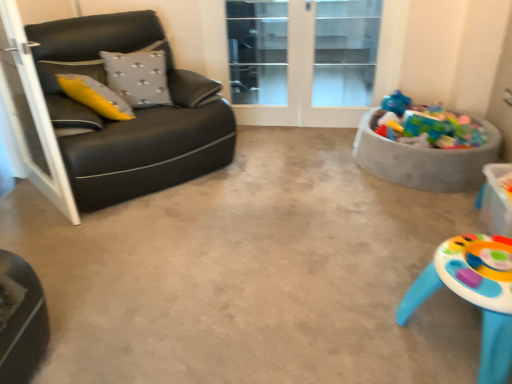
Question: Does transparent glass screen door at upper center, which ranks as the first screen door in right-to-left order, have a smaller size compared to plastic colorful toys at right?

Choices:
 (A) yes
 (B) no

Answer: (A)

Question: Is transparent glass screen door at upper center, placed as the 1th screen door when sorted from back to front, facing away from plastic colorful toys at right?

Choices:
 (A) no
 (B) yes

Answer: (A)

Question: Is transparent glass screen door at upper center, the second screen door when ordered from front to back, to the left of plastic colorful toys at right from the viewer's perspective?

Choices:
 (A) no
 (B) yes

Answer: (B)

Question: Is transparent glass screen door at upper center, which is the 2th screen door from left to right, wider than plastic colorful toys at right?

Choices:
 (A) yes
 (B) no

Answer: (B)

Question: From a real-world perspective, is transparent glass screen door at upper center, which ranks as the first screen door in right-to-left order, positioned over plastic colorful toys at right based on gravity?

Choices:
 (A) yes
 (B) no

Answer: (A)

Question: Is transparent glass door at center bigger or smaller than black leather couch at left?

Choices:
 (A) small
 (B) big

Answer: (A)

Question: Considering the positions of point (337, 54) and point (150, 127), is point (337, 54) closer or farther from the camera than point (150, 127)?

Choices:
 (A) closer
 (B) farther

Answer: (B)

Question: Looking at their shapes, would you say transparent glass door at center is wider or thinner than black leather couch at left?

Choices:
 (A) wide
 (B) thin

Answer: (B)

Question: From the image's perspective, is transparent glass door at center positioned above or below black leather couch at left?

Choices:
 (A) above
 (B) below

Answer: (A)

Question: Considering the positions of transparent glass door at center and plastic colorful toys at right in the image, is transparent glass door at center wider or thinner than plastic colorful toys at right?

Choices:
 (A) wide
 (B) thin

Answer: (B)

Question: Is point (361, 97) closer or farther from the camera than point (373, 112)?

Choices:
 (A) closer
 (B) farther

Answer: (B)

Question: In the image, is transparent glass door at center on the left side or the right side of plastic colorful toys at right?

Choices:
 (A) right
 (B) left

Answer: (B)

Question: From a real-world perspective, is transparent glass door at center positioned above or below plastic colorful toys at right?

Choices:
 (A) below
 (B) above

Answer: (B)

Question: Does point (238, 6) appear closer or farther from the camera than point (230, 77)?

Choices:
 (A) farther
 (B) closer

Answer: (B)

Question: Based on their sizes in the image, would you say transparent glass screen door at upper center, the second screen door when ordered from front to back, is bigger or smaller than transparent glass door at center?

Choices:
 (A) small
 (B) big

Answer: (A)